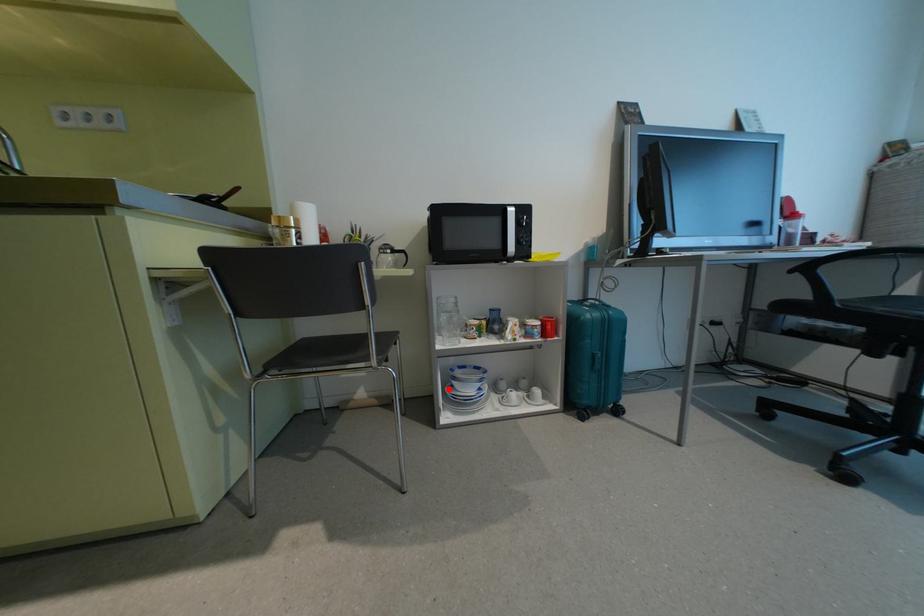
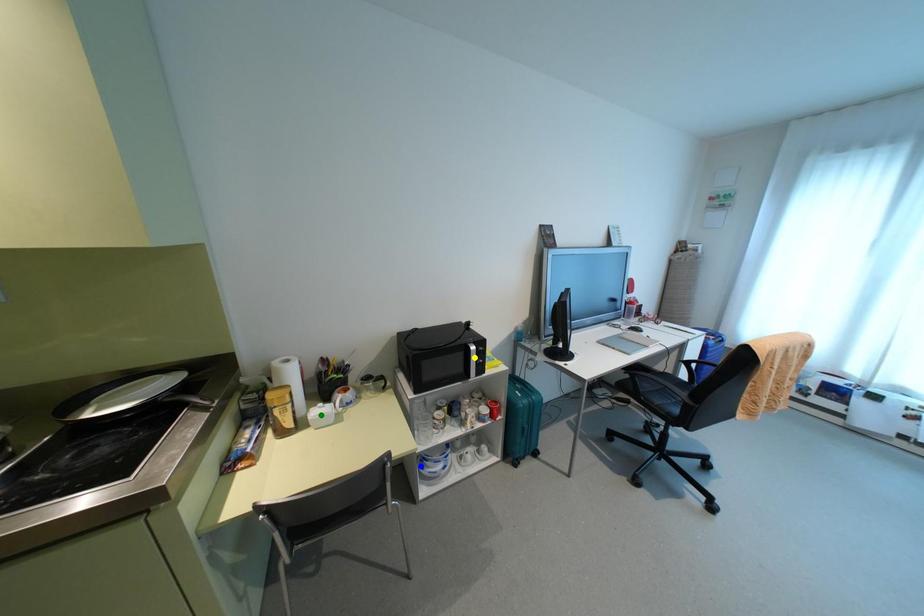
Question: I am providing you with two images of the same scene from different viewpoints. A red point is marked on the first image. You are given multiple points on the second image. Which point in image 2 represents the same 3d spot as the red point in image 1?

Choices:
 (A) green point
 (B) blue point
 (C) yellow point

Answer: (B)